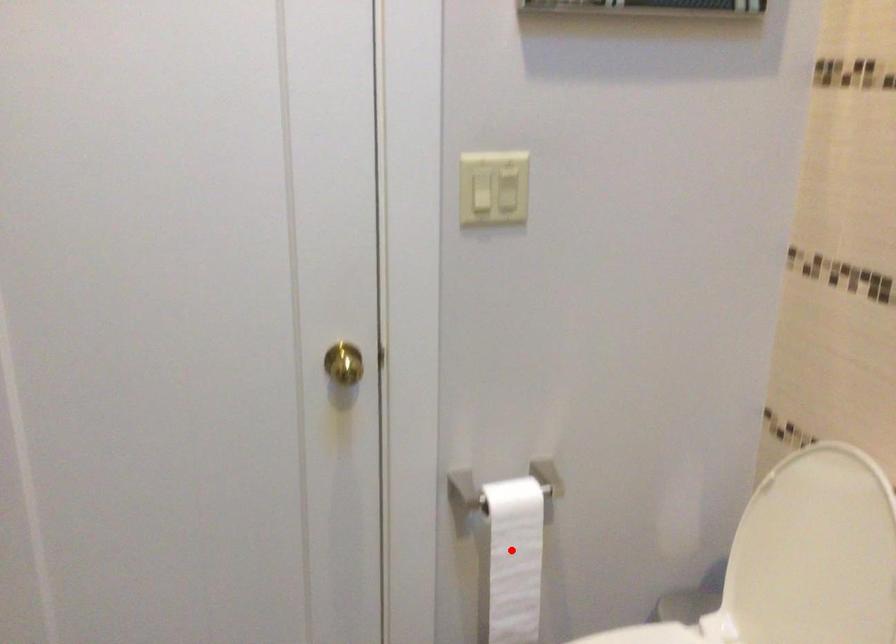
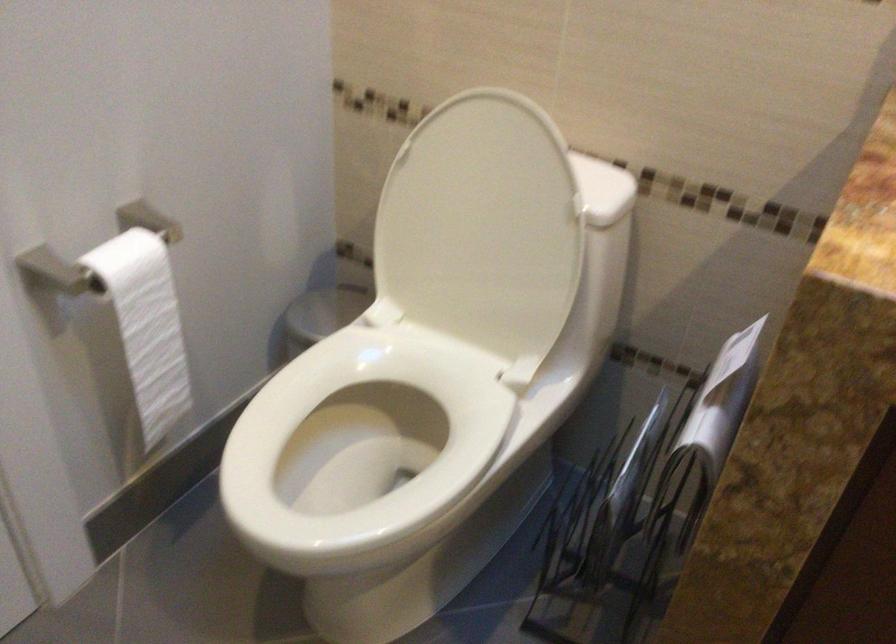
Find the pixel in the second image that matches the highlighted location in the first image.

(147, 325)